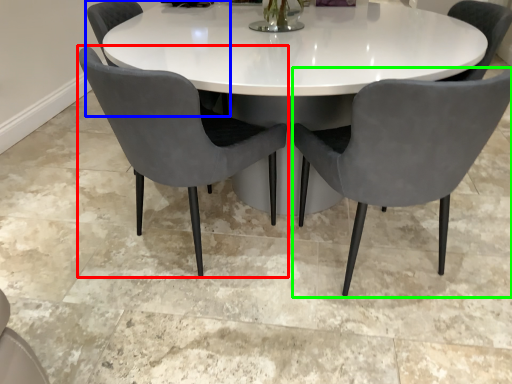
Question: Estimate the real-world distances between objects in this image. Which object is farther from chair (highlighted by a red box), chair (highlighted by a blue box) or chair (highlighted by a green box)?

Choices:
 (A) chair
 (B) chair

Answer: (A)